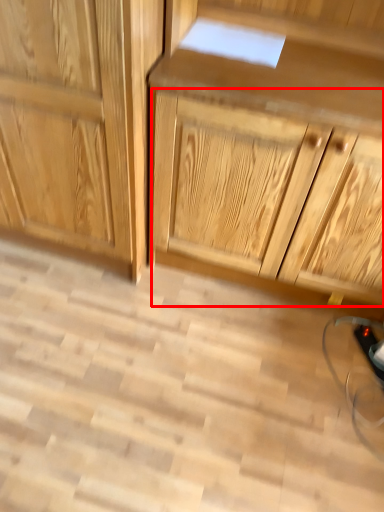
Question: From the image, what is the correct spatial relationship of drawer (annotated by the red box) in relation to cabinetry?

Choices:
 (A) right
 (B) left

Answer: (A)